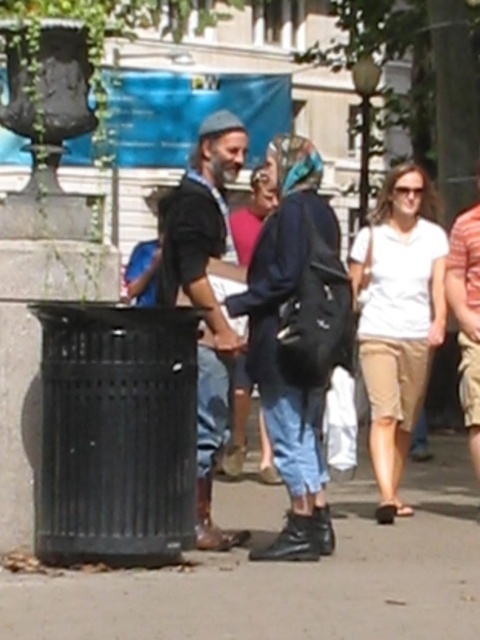
Question: Can you confirm if black rubber boots at lower center is positioned to the right of denim jacket at center?

Choices:
 (A) no
 (B) yes

Answer: (A)

Question: Estimate the real-world distances between objects in this image. Which object is closer to the denim jacket at center?

Choices:
 (A) white cotton shirt at center
 (B) dark brown leather boots at center

Answer: (B)

Question: Which point is farther from the camera taking this photo?

Choices:
 (A) (284, 637)
 (B) (269, 548)
 (C) (430, 193)
 (D) (214, 220)

Answer: (C)

Question: Among these points, which one is nearest to the camera?

Choices:
 (A) (365, 316)
 (B) (210, 547)
 (C) (216, 589)

Answer: (C)

Question: Can you confirm if denim jacket at center is wider than white cotton shirt at center?

Choices:
 (A) yes
 (B) no

Answer: (B)

Question: Can you confirm if black rubber boots at lower center is positioned to the right of white cotton shirt at center?

Choices:
 (A) yes
 (B) no

Answer: (B)